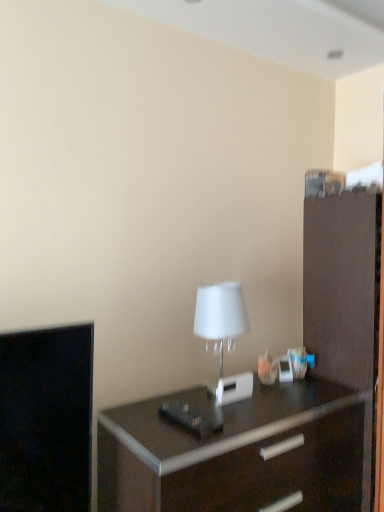
Question: Can you confirm if dark wood chest of drawers at center is bigger than white matte table lamp at center?

Choices:
 (A) no
 (B) yes

Answer: (B)

Question: Can you confirm if dark wood chest of drawers at center is shorter than white matte table lamp at center?

Choices:
 (A) yes
 (B) no

Answer: (B)

Question: Is dark wood chest of drawers at center not inside white matte table lamp at center?

Choices:
 (A) yes
 (B) no

Answer: (A)

Question: Does dark wood chest of drawers at center have a greater height compared to white matte table lamp at center?

Choices:
 (A) no
 (B) yes

Answer: (B)

Question: From a real-world perspective, does dark wood chest of drawers at center stand above white matte table lamp at center?

Choices:
 (A) yes
 (B) no

Answer: (B)

Question: Is dark wood chest of drawers at center in front of or behind white matte table lamp at center in the image?

Choices:
 (A) behind
 (B) front

Answer: (B)

Question: Which is correct: dark wood chest of drawers at center is inside white matte table lamp at center, or outside of it?

Choices:
 (A) outside
 (B) inside

Answer: (A)

Question: Is point (230, 452) positioned closer to the camera than point (230, 324)?

Choices:
 (A) closer
 (B) farther

Answer: (A)

Question: From the image's perspective, is dark wood chest of drawers at center positioned above or below white matte table lamp at center?

Choices:
 (A) above
 (B) below

Answer: (B)

Question: From their relative heights in the image, would you say brown matte file cabinet at right is taller or shorter than white matte table lamp at center?

Choices:
 (A) tall
 (B) short

Answer: (A)

Question: Choose the correct answer: Is brown matte file cabinet at right inside white matte table lamp at center or outside it?

Choices:
 (A) outside
 (B) inside

Answer: (A)

Question: Does point (322, 223) appear closer or farther from the camera than point (238, 322)?

Choices:
 (A) closer
 (B) farther

Answer: (B)

Question: Visually, is brown matte file cabinet at right positioned to the left or to the right of white matte table lamp at center?

Choices:
 (A) left
 (B) right

Answer: (B)

Question: Is dark wood chest of drawers at center to the left or to the right of brown matte file cabinet at right in the image?

Choices:
 (A) right
 (B) left

Answer: (B)

Question: From the image's perspective, is dark wood chest of drawers at center positioned above or below brown matte file cabinet at right?

Choices:
 (A) below
 (B) above

Answer: (A)